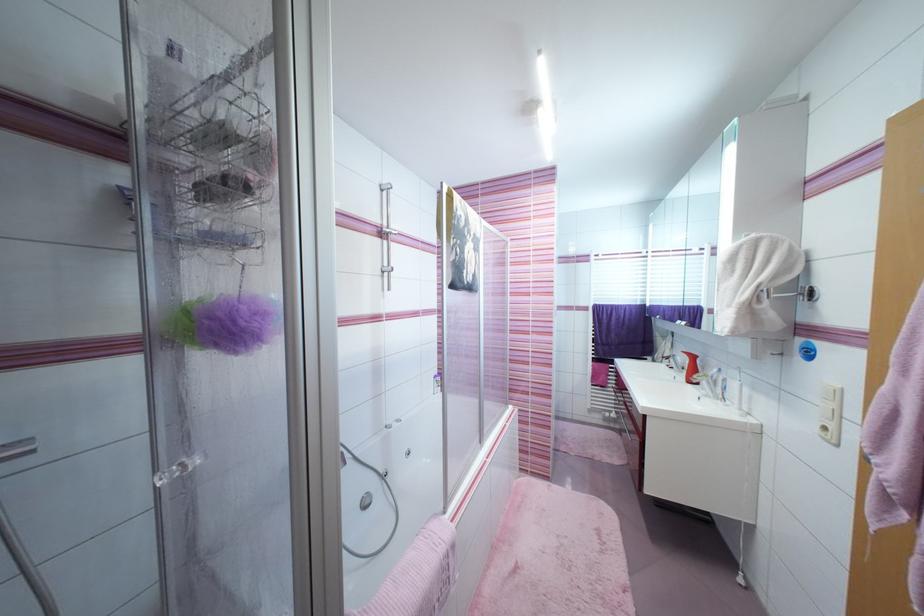
Where would you turn the bathtub control knob? Please return your answer as a coordinate pair (x, y).

(365, 500)